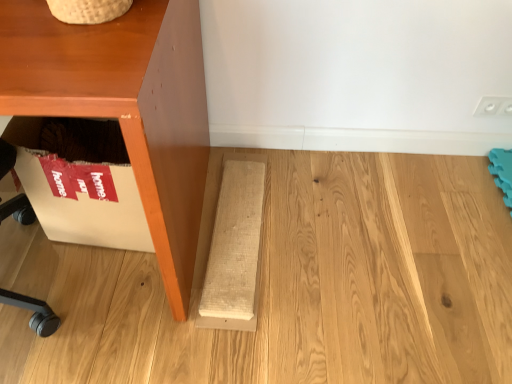
Where is `spots to the right of natural wood plank at lower center`? The image size is (512, 384). spots to the right of natural wood plank at lower center is located at coordinates (355, 239).